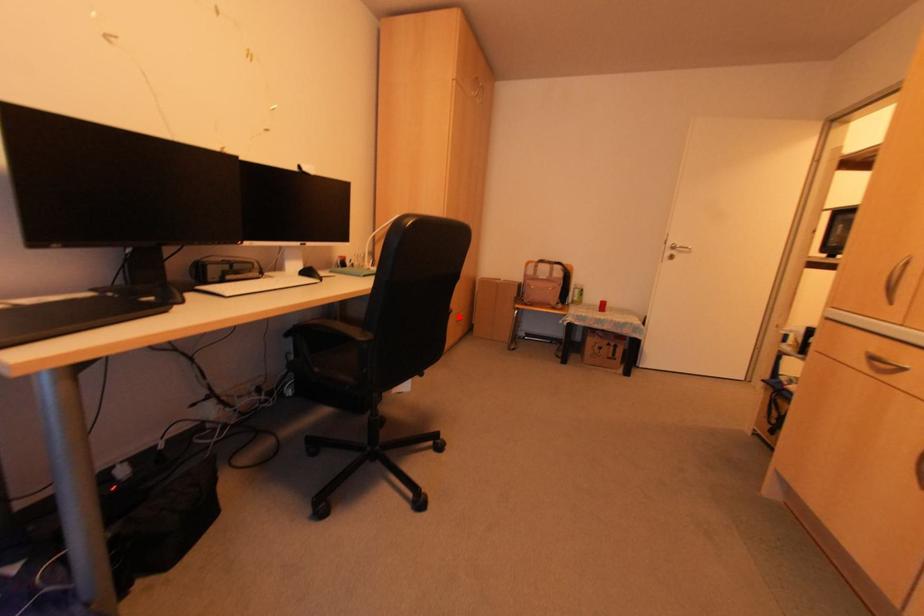
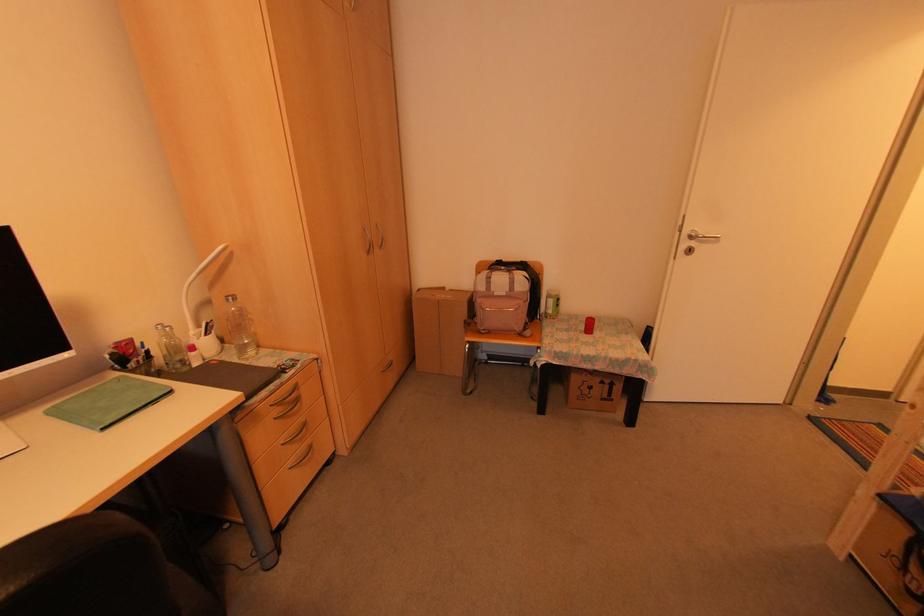
Find the pixel in the second image that matches the highlighted location in the first image.

(388, 359)